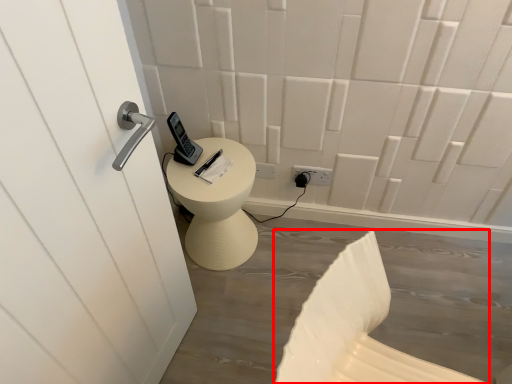
Question: In this image, where is swivel chair (annotated by the red box) located relative to electric outlet?

Choices:
 (A) left
 (B) right

Answer: (B)